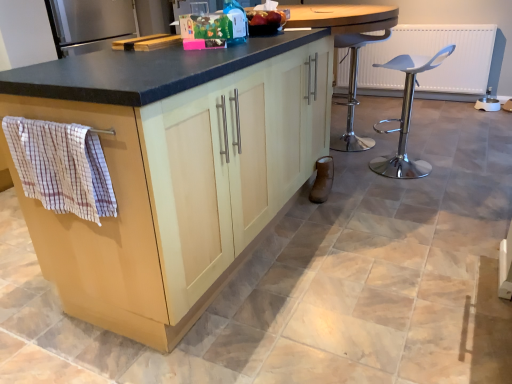
Question: Is matte wood cabinet at left situated inside checkered fabric hand towel at left or outside?

Choices:
 (A) inside
 (B) outside

Answer: (B)

Question: Is matte wood cabinet at left in front of or behind checkered fabric hand towel at left in the image?

Choices:
 (A) behind
 (B) front

Answer: (B)

Question: Which object is positioned closest to the checkered fabric hand towel at left?

Choices:
 (A) matte wood cabinet at left
 (B) white plastic stool at right

Answer: (A)

Question: Which object is the closest to the checkered fabric hand towel at left?

Choices:
 (A) white plastic stool at right
 (B) matte wood cabinet at left

Answer: (B)